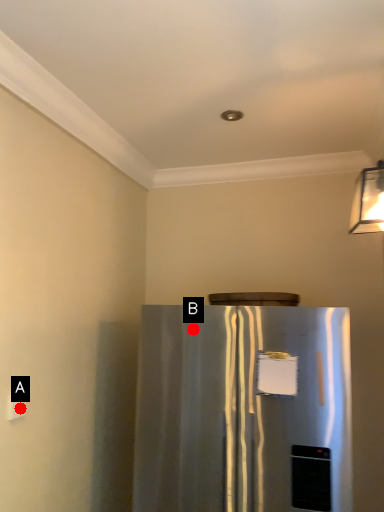
Question: Two points are circled on the image, labeled by A and B beside each circle. Which point is farther to the camera?

Choices:
 (A) A is further
 (B) B is further

Answer: (B)